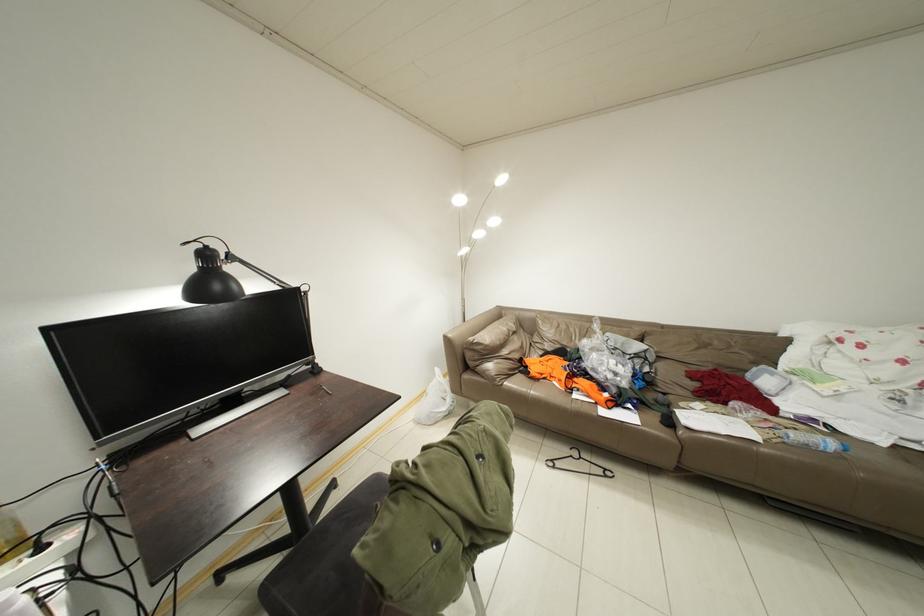
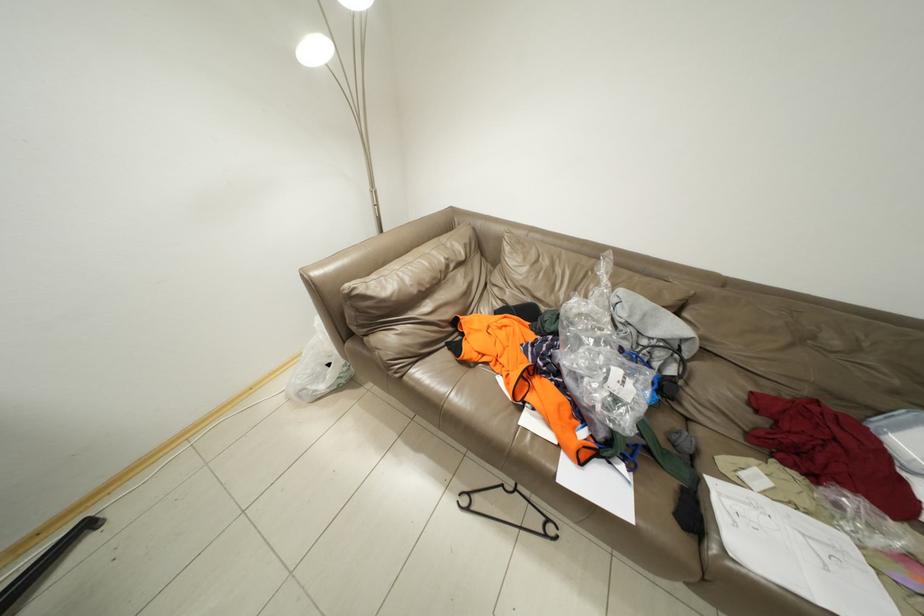
Which direction would the cameraman need to move to produce the second image?

The cameraman walked toward right, forward.